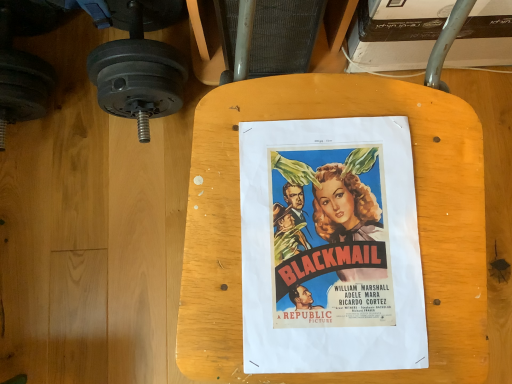
Question: Is matte paper poster at center situated inside matte black dumbbell at left or outside?

Choices:
 (A) inside
 (B) outside

Answer: (B)

Question: From the image's perspective, is matte paper poster at center located above or below matte black dumbbell at left?

Choices:
 (A) above
 (B) below

Answer: (B)

Question: Which object is the farthest from the matte paper poster at center?

Choices:
 (A) wooden table at center
 (B) matte black dumbbell at left

Answer: (B)

Question: Estimate the real-world distances between objects in this image. Which object is farther from the matte paper poster at center?

Choices:
 (A) wooden table at center
 (B) matte black dumbbell at left

Answer: (B)